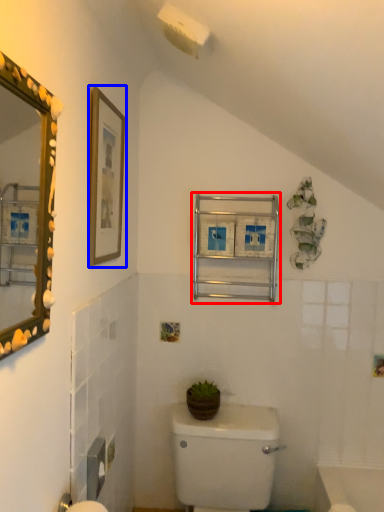
Question: Which object is closer to the camera taking this photo, medicine cabinet (highlighted by a red box) or picture frame (highlighted by a blue box)?

Choices:
 (A) medicine cabinet
 (B) picture frame

Answer: (B)